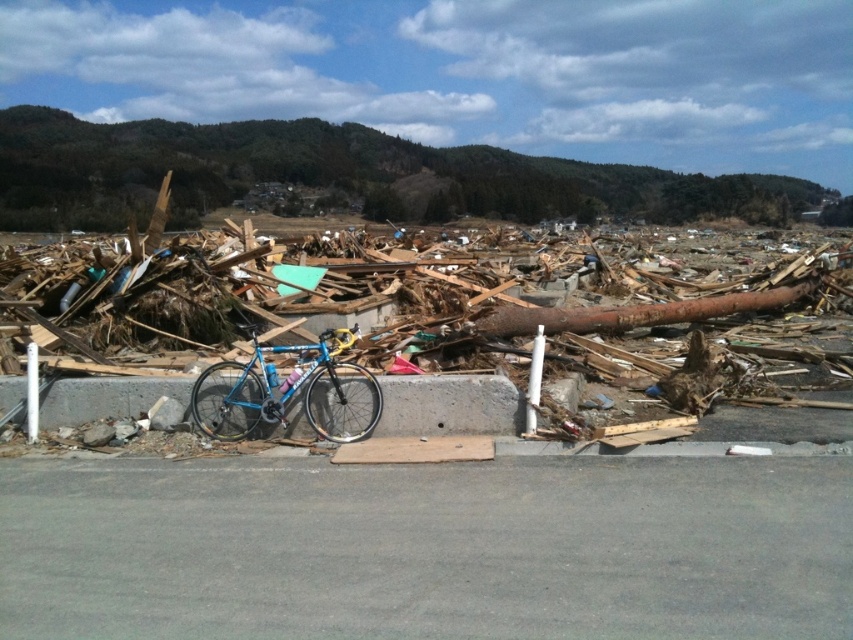
Which is more to the right, concrete at center or shiny blue frame bicycle at center?

concrete at center is more to the right.

How far apart are concrete at center and shiny blue frame bicycle at center?

A distance of 99.56 centimeters exists between concrete at center and shiny blue frame bicycle at center.

Locate an element on the screen. The height and width of the screenshot is (640, 853). concrete at center is located at coordinates (450, 404).

Identify the location of shiny blue frame bicycle at center. Image resolution: width=853 pixels, height=640 pixels. (289, 392).

Between shiny blue frame bicycle at center and rusty metal log at center, which one has more height?

Standing taller between the two is shiny blue frame bicycle at center.

Between point (320, 428) and point (654, 320), which one is positioned in front?

Point (320, 428)

Where is `shiny blue frame bicycle at center`? shiny blue frame bicycle at center is located at coordinates (289, 392).

How far apart are concrete at center and rusty metal log at center?

The distance of concrete at center from rusty metal log at center is 6.38 meters.

The width and height of the screenshot is (853, 640). Find the location of `concrete at center`. concrete at center is located at coordinates (450, 404).

What are the coordinates of `concrete at center` in the screenshot? It's located at (450, 404).